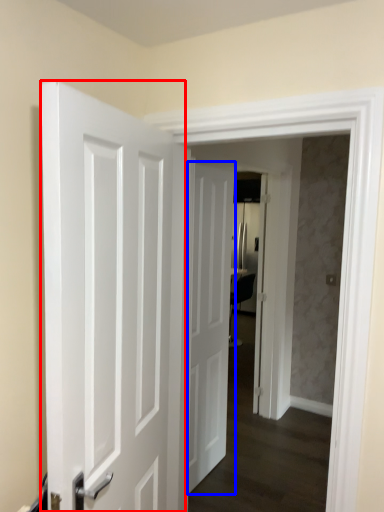
Question: Which of the following is the closest to the observer, door (highlighted by a red box) or door (highlighted by a blue box)?

Choices:
 (A) door
 (B) door

Answer: (A)